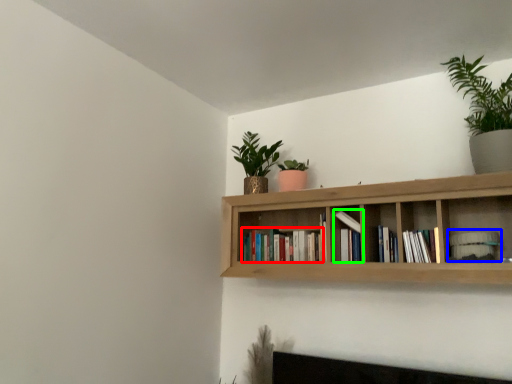
Question: Estimate the real-world distances between objects in this image. Which object is farther from book (highlighted by a red box), book (highlighted by a blue box) or book (highlighted by a green box)?

Choices:
 (A) book
 (B) book

Answer: (A)